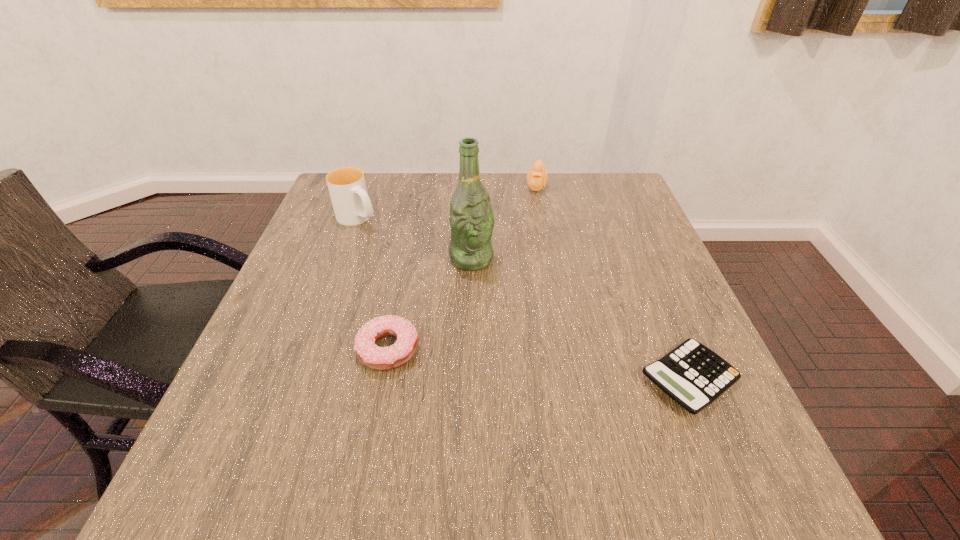
This screenshot has height=540, width=960. What are the coordinates of `free space on the desktop that is between the fourth object from right to left and the rightmost object and is positioned on the face of the duckling` in the screenshot? It's located at (511, 361).

The width and height of the screenshot is (960, 540). I want to click on free space on the desktop that is between the second object from left to right and the rightmost object and is positioned with the handle on the side of the fourth shortest object, so click(x=556, y=366).

Locate an element on the screen. This screenshot has height=540, width=960. free space on the desktop that is between the fourth object from right to left and the shortest object and is positioned on the surface of the third nearest object is located at coordinates (575, 368).